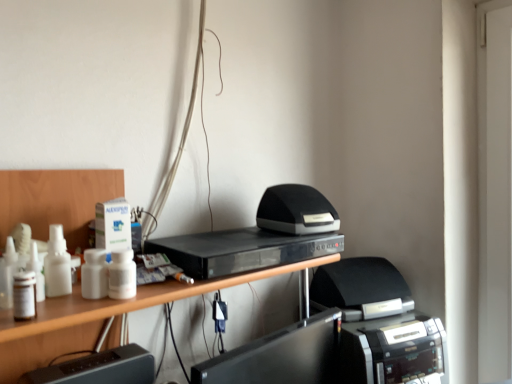
Question: From a real-world perspective, is black glossy monitor at lower center, arranged as the 2th register when viewed from the left, positioned under black plastic dvd player at center based on gravity?

Choices:
 (A) yes
 (B) no

Answer: (A)

Question: Is black glossy monitor at lower center, the first register from the right, oriented towards black plastic dvd player at center?

Choices:
 (A) no
 (B) yes

Answer: (A)

Question: Is black glossy monitor at lower center, the first register from the right, positioned beyond the bounds of black plastic dvd player at center?

Choices:
 (A) no
 (B) yes

Answer: (B)

Question: Considering the relative positions of black glossy monitor at lower center, the first register from the right, and black plastic dvd player at center in the image provided, is black glossy monitor at lower center, the first register from the right, in front of black plastic dvd player at center?

Choices:
 (A) no
 (B) yes

Answer: (B)

Question: Does black glossy monitor at lower center, arranged as the 2th register when viewed from the left, have a greater width compared to black plastic dvd player at center?

Choices:
 (A) yes
 (B) no

Answer: (A)

Question: From the image's perspective, is black plastic printer at lower right, the second printer viewed from the top, located above or below black plastic dvd player at center?

Choices:
 (A) above
 (B) below

Answer: (B)

Question: Is black plastic printer at lower right, which is the 1th printer in bottom-to-top order, taller or shorter than black plastic dvd player at center?

Choices:
 (A) short
 (B) tall

Answer: (B)

Question: Is black plastic printer at lower right, the second printer viewed from the top, bigger or smaller than black plastic dvd player at center?

Choices:
 (A) big
 (B) small

Answer: (A)

Question: From a real-world perspective, is black plastic printer at lower right, the second printer viewed from the top, positioned above or below black plastic dvd player at center?

Choices:
 (A) below
 (B) above

Answer: (A)

Question: Is black glossy monitor at lower center, the first register from the right, to the left or to the right of black matte speaker at center, which ranks as the second printer in bottom-to-top order, in the image?

Choices:
 (A) left
 (B) right

Answer: (A)

Question: Relative to black matte speaker at center, the first printer positioned from the top, is black glossy monitor at lower center, arranged as the 2th register when viewed from the left, in front or behind?

Choices:
 (A) front
 (B) behind

Answer: (A)

Question: Is black glossy monitor at lower center, the first register from the right, taller or shorter than black matte speaker at center, which ranks as the second printer in bottom-to-top order?

Choices:
 (A) tall
 (B) short

Answer: (A)

Question: Is black glossy monitor at lower center, the first register from the right, wider or thinner than black matte speaker at center, which ranks as the second printer in bottom-to-top order?

Choices:
 (A) wide
 (B) thin

Answer: (A)

Question: From a real-world perspective, relative to black plastic register at lower left, the first register positioned from the left, is black matte speaker at center, the first printer positioned from the top, vertically above or below?

Choices:
 (A) above
 (B) below

Answer: (A)

Question: Considering the positions of point (274, 220) and point (25, 375), is point (274, 220) closer or farther from the camera than point (25, 375)?

Choices:
 (A) closer
 (B) farther

Answer: (B)